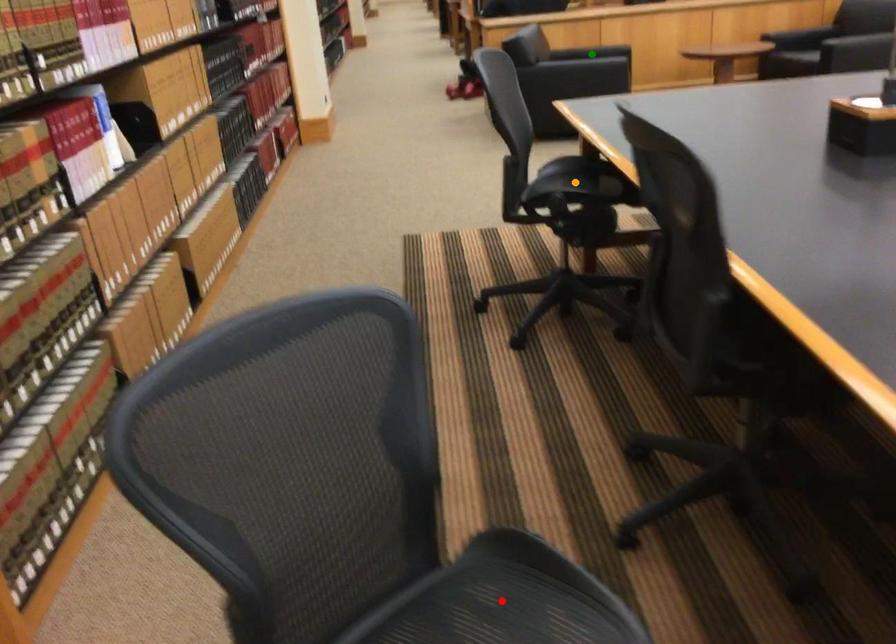
Order these from farthest to nearest:
A) green point
B) orange point
C) red point

green point
orange point
red point